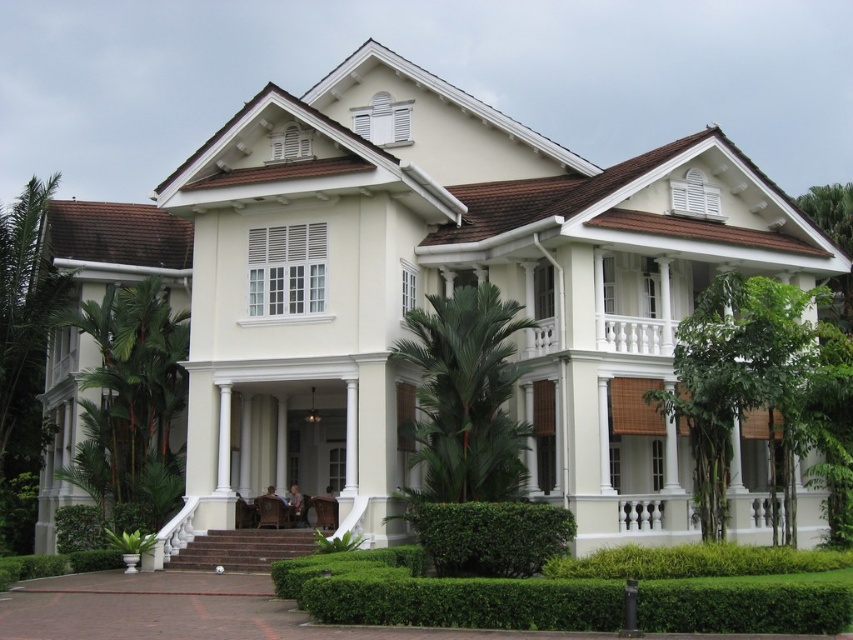
You are standing in front of the two story colonial style house and see a point marked at coordinates [490,536]. What is located at that point?

The point at coordinates [490,536] marks a green leafy hedge at lower center.

You are a gardener planning to trim the hedges in the front yard. You need to know which of the green leafy hedge at lower center or the green leafy hedge at lower left is narrower so you can decide which one requires less time to maintain. Which hedge is narrower?

The green leafy hedge at lower center is narrower than the green leafy hedge at lower left, so it requires less time to maintain.

You are standing at point (566, 532) and want to reach the front door of the house. The house is 42.30 meters away from you. Is the house in your immediate vicinity?

The house is 42.30 meters away from point (566, 532), so it is not in immediate vicinity as it requires a short walk.